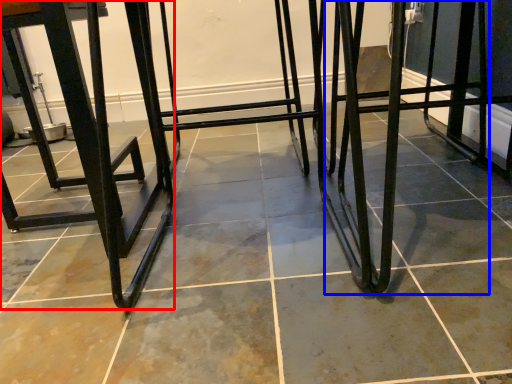
Question: Which object is closer to the camera taking this photo, furniture (highlighted by a red box) or step stool (highlighted by a blue box)?

Choices:
 (A) furniture
 (B) step stool

Answer: (B)